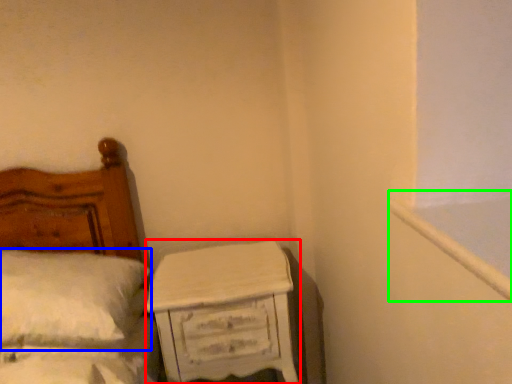
Question: Estimate the real-world distances between objects in this image. Which object is farther from nightstand (highlighted by a red box), pillow (highlighted by a blue box) or window frame (highlighted by a green box)?

Choices:
 (A) pillow
 (B) window frame

Answer: (B)